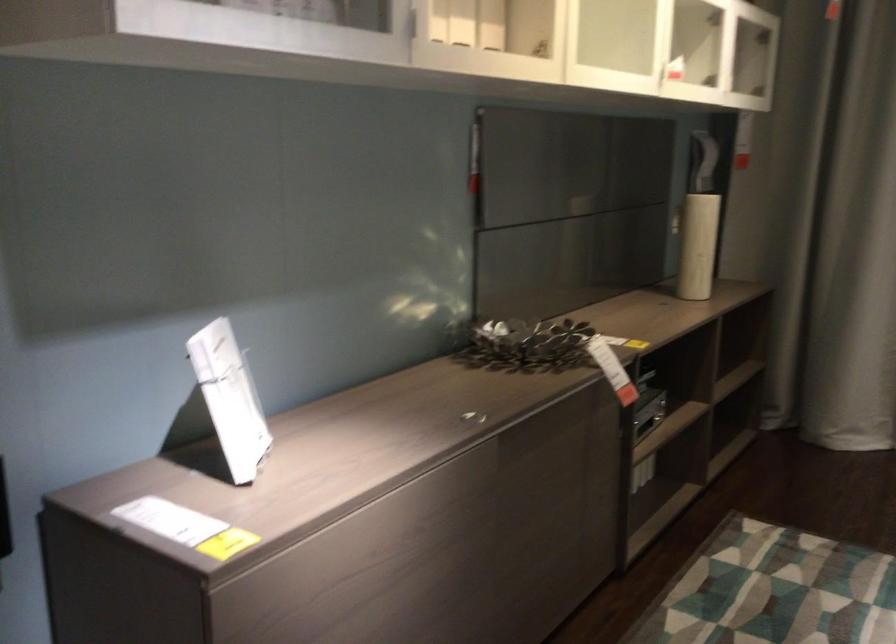
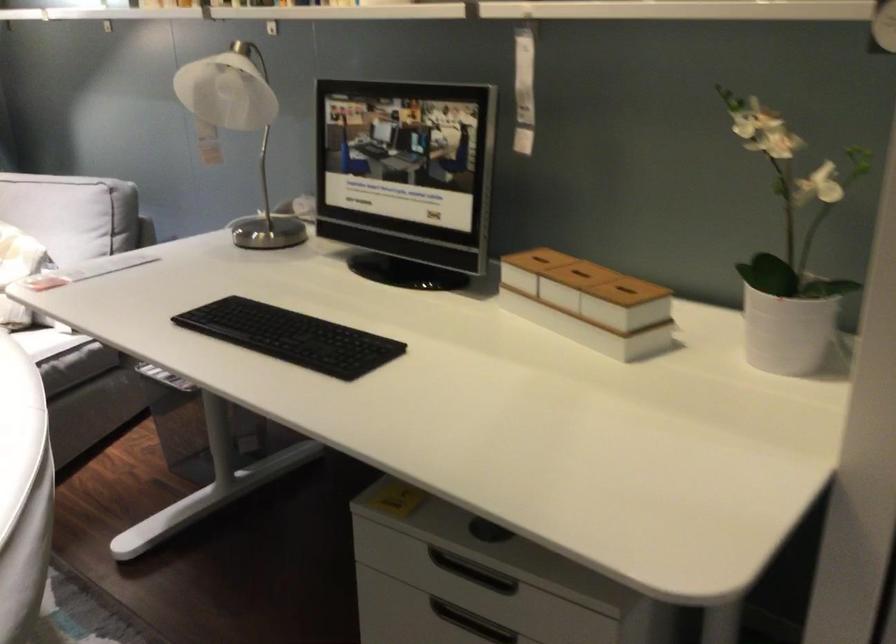
Based on the continuous images, in which direction is the camera rotating?

The rotation direction of the camera is right-down.